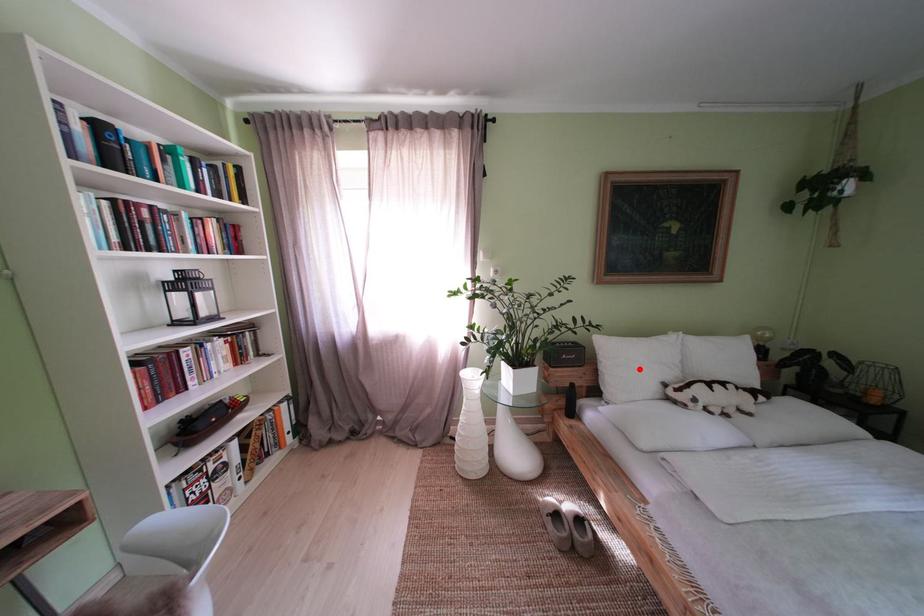
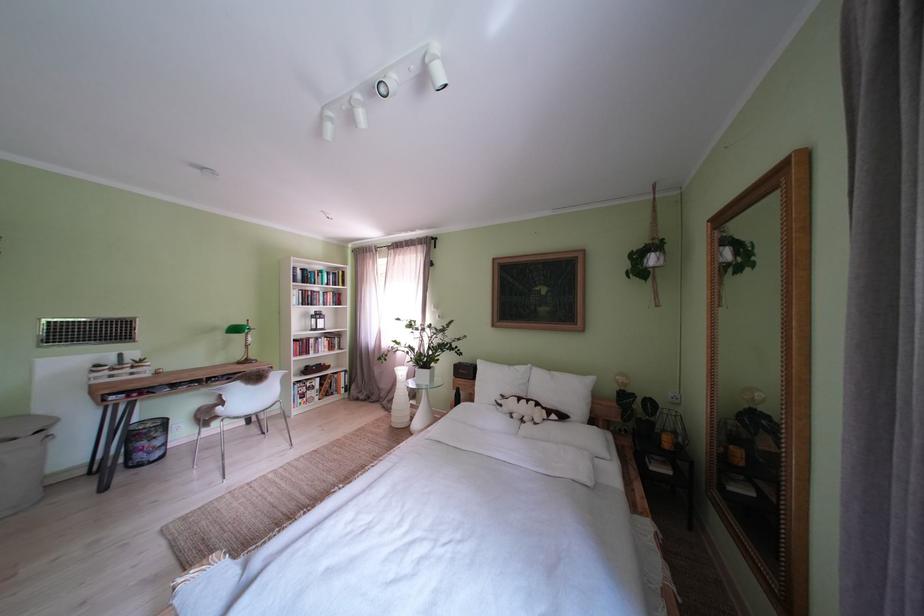
Find the pixel in the second image that matches the highlighted location in the first image.

(500, 386)